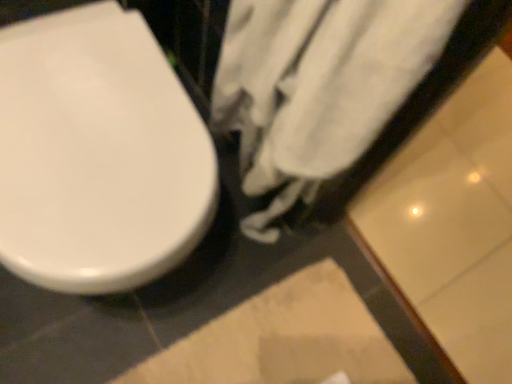
Question: Can we say white cotton towel at center lies outside beige textured rug at lower center?

Choices:
 (A) yes
 (B) no

Answer: (A)

Question: Is white cotton towel at center wider than beige textured rug at lower center?

Choices:
 (A) no
 (B) yes

Answer: (A)

Question: Is white cotton towel at center oriented away from beige textured rug at lower center?

Choices:
 (A) no
 (B) yes

Answer: (A)

Question: Is white cotton towel at center behind beige textured rug at lower center?

Choices:
 (A) no
 (B) yes

Answer: (A)

Question: Can you confirm if white cotton towel at center is shorter than beige textured rug at lower center?

Choices:
 (A) no
 (B) yes

Answer: (A)

Question: Does white cotton towel at center have a lesser width compared to beige textured rug at lower center?

Choices:
 (A) yes
 (B) no

Answer: (A)

Question: Can you confirm if beige textured rug at lower center is taller than white cotton towel at center?

Choices:
 (A) no
 (B) yes

Answer: (A)

Question: Is beige textured rug at lower center outside white cotton towel at center?

Choices:
 (A) no
 (B) yes

Answer: (B)

Question: From the image's perspective, would you say beige textured rug at lower center is positioned over white cotton towel at center?

Choices:
 (A) yes
 (B) no

Answer: (B)

Question: Could you tell me if beige textured rug at lower center is facing white cotton towel at center?

Choices:
 (A) yes
 (B) no

Answer: (B)

Question: Can you confirm if beige textured rug at lower center is bigger than white cotton towel at center?

Choices:
 (A) no
 (B) yes

Answer: (A)

Question: Considering the relative sizes of beige textured rug at lower center and white cotton towel at center in the image provided, is beige textured rug at lower center shorter than white cotton towel at center?

Choices:
 (A) yes
 (B) no

Answer: (A)

Question: From a real-world perspective, is white glossy toilet seat at left located beneath white cotton towel at center?

Choices:
 (A) no
 (B) yes

Answer: (B)